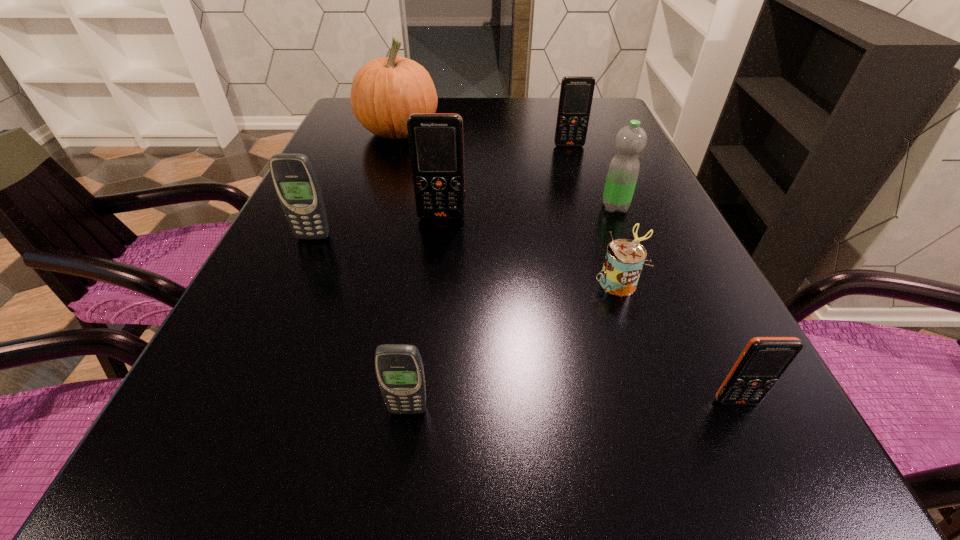
Identify the location of the nearer gray cellular telephone. The width and height of the screenshot is (960, 540). (399, 369).

I want to click on the right gray cellular telephone, so click(399, 369).

The height and width of the screenshot is (540, 960). I want to click on can, so click(624, 260).

Where is `the shortest object`? the shortest object is located at coordinates [x=624, y=260].

Locate an element on the screen. The image size is (960, 540). free spot located 0.340m on the stem of the pumpkin is located at coordinates (562, 132).

Locate an element on the screen. This screenshot has height=540, width=960. blank space located 0.130m on the screen of the leftmost orange cellular telephone is located at coordinates (437, 262).

Locate an element on the screen. This screenshot has width=960, height=540. free space located on the back of the water bottle is located at coordinates (606, 183).

You are a GUI agent. You are given a task and a screenshot of the screen. Output one action in this format:
    pyautogui.click(x=<x>, y=<y>)
    Task: Click on the vacant area situated on the screen of the left gray cellular telephone
    The height and width of the screenshot is (540, 960).
    Given the screenshot: What is the action you would take?
    pyautogui.click(x=304, y=256)

Identify the location of vacant space located on the screen of the second biggest orange cellular telephone. The width and height of the screenshot is (960, 540). [581, 181].

Where is `free region located 0.100m on the screen of the rightmost object`? This screenshot has width=960, height=540. free region located 0.100m on the screen of the rightmost object is located at coordinates (774, 480).